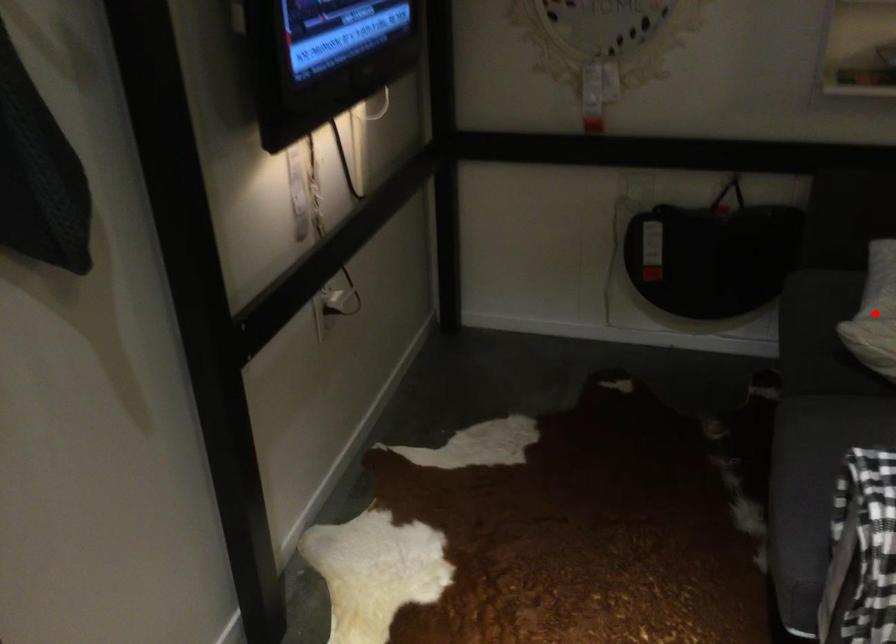
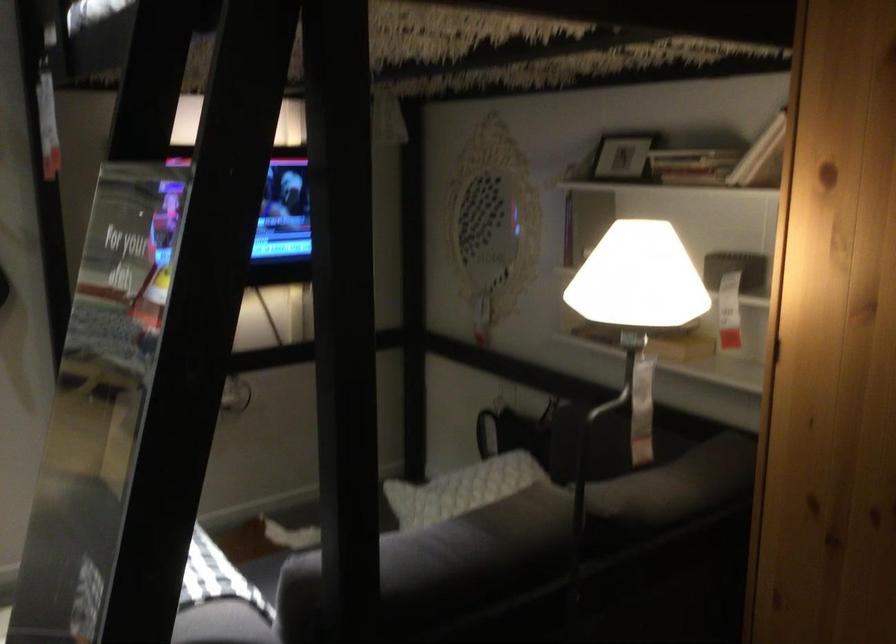
Question: I am providing you with two images of the same scene from different viewpoints. A red point is marked on the first image. Is the red point's position out of view in image 2?

Choices:
 (A) Yes
 (B) No

Answer: (A)